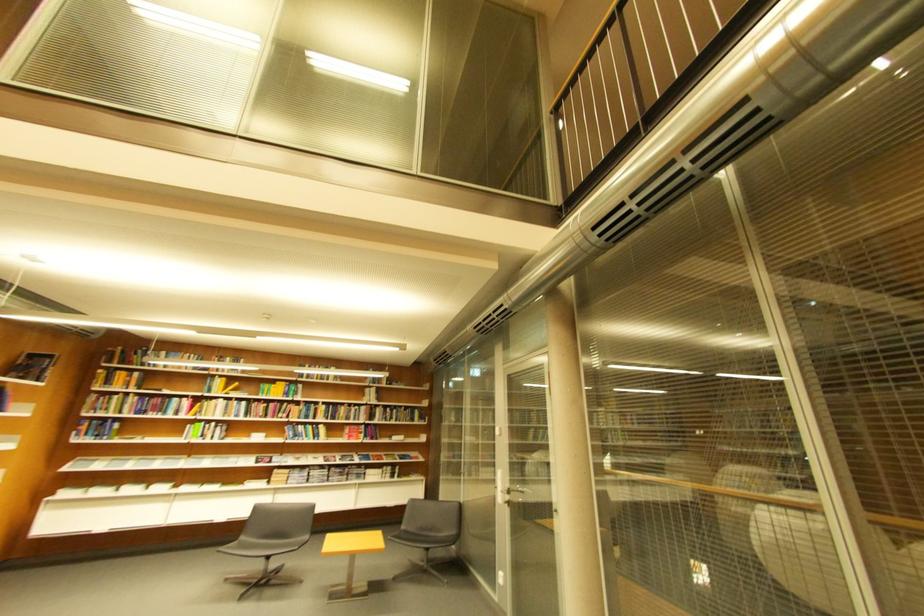
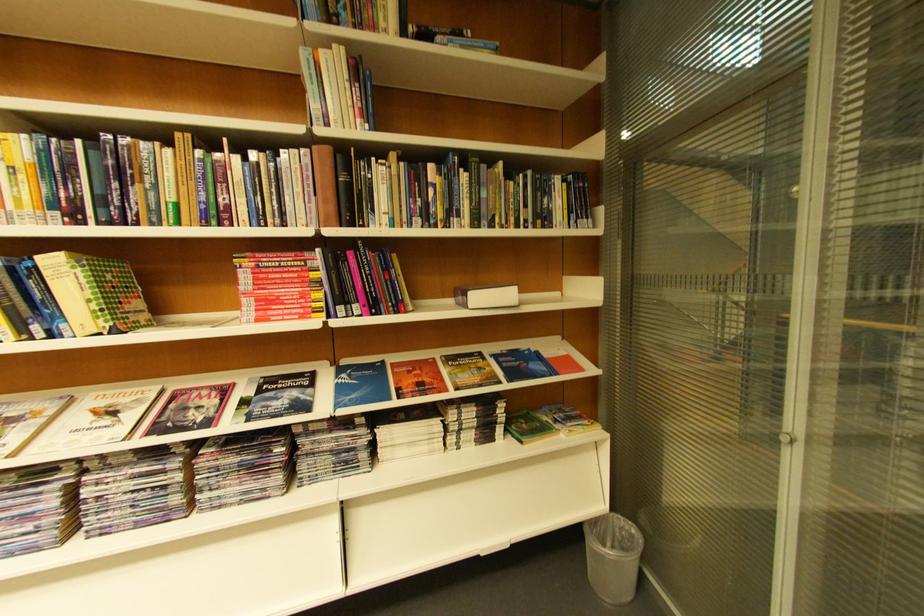
Question: I am providing you with two images of the same scene from different viewpoints. After the viewpoint changes to image2, which objects are now occluded?

Choices:
 (A) grey trash can
 (B) Nature magazine
 (C) stacked magazine
 (D) none of these

Answer: (D)